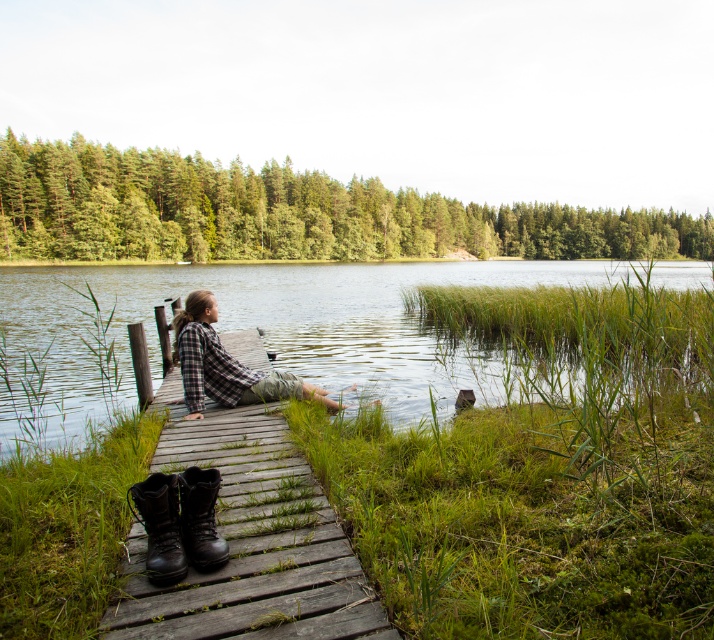
Question: From the image, what is the correct spatial relationship of clear water at dock center in relation to wooden dock at center?

Choices:
 (A) right
 (B) left

Answer: (B)

Question: Which point appears farthest from the camera in this image?

Choices:
 (A) (216, 333)
 (B) (169, 372)
 (C) (183, 346)
 (D) (211, 513)

Answer: (B)

Question: Among these objects, which one is nearest to the camera?

Choices:
 (A) clear water at dock center
 (B) black leather boots at lower left
 (C) black leather boot at lower center
 (D) plaid fabric shirt at center

Answer: (B)

Question: Which point is farther to the camera?

Choices:
 (A) black leather boot at lower center
 (B) black leather boots at lower left
 (C) clear water at dock center

Answer: (C)

Question: Does clear water at dock center appear under black leather boot at lower center?

Choices:
 (A) yes
 (B) no

Answer: (B)

Question: Does clear water at dock center come in front of wooden dock at center?

Choices:
 (A) yes
 (B) no

Answer: (B)